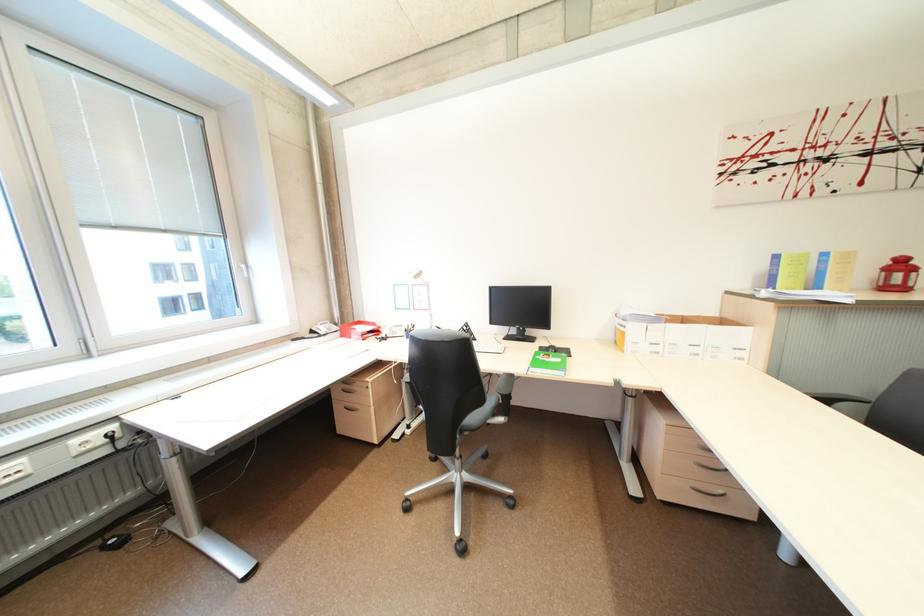
Find where to sit the chair sitting surface. Please return your answer as a coordinate pair (x, y).

(479, 415)